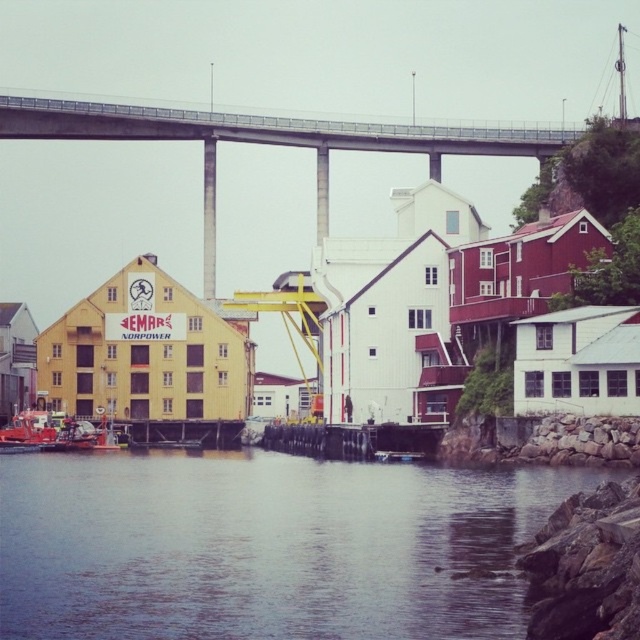
Question: Can you confirm if smooth water at lower center is smaller than concrete bridge at upper center?

Choices:
 (A) yes
 (B) no

Answer: (A)

Question: Does smooth water at lower center have a greater width compared to concrete bridge at upper center?

Choices:
 (A) yes
 (B) no

Answer: (B)

Question: Which of the following is the farthest from the observer?

Choices:
 (A) [76, 570]
 (B) [84, 125]

Answer: (B)

Question: Which point is closer to the camera taking this photo?

Choices:
 (A) (236, 470)
 (B) (115, 122)

Answer: (A)

Question: Does smooth water at lower center have a smaller size compared to concrete bridge at upper center?

Choices:
 (A) no
 (B) yes

Answer: (B)

Question: Which of the following is the farthest from the observer?

Choices:
 (A) coord(268,582)
 (B) coord(324,182)

Answer: (B)